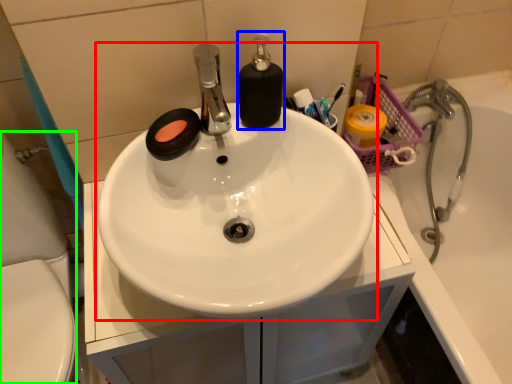
Question: Which is nearer to the sink (highlighted by a red box)? soap dispenser (highlighted by a blue box) or porcelain (highlighted by a green box).

Choices:
 (A) soap dispenser
 (B) porcelain

Answer: (A)